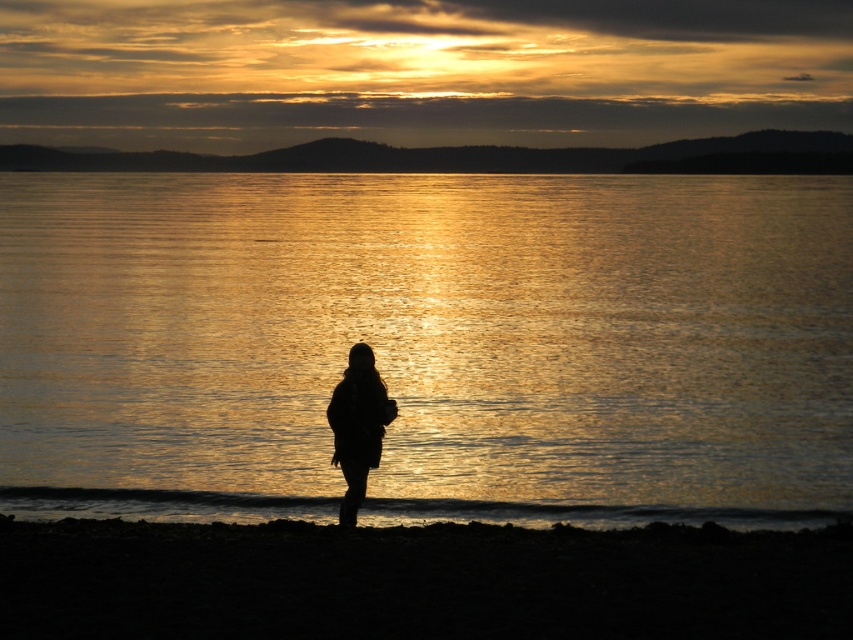
You are standing on the shore of the lake observing the sunset. You notice the glistening reflective water at center and the silhouette fabric at center. Which object is positioned higher in the scene?

The glistening reflective water at center is above the silhouette fabric at center, so it is positioned higher in the scene.

You are an artist trying to paint the sunset scene. You have two main elements to focus on in the center of your canvas, the glistening reflective water at center and the silhouette fabric at center. Which element should you make larger to stay true to the actual scene?

The glistening reflective water at center has a larger size compared to the silhouette fabric at center, so you should make the glistening reflective water at center larger in your painting to accurately represent the scene.